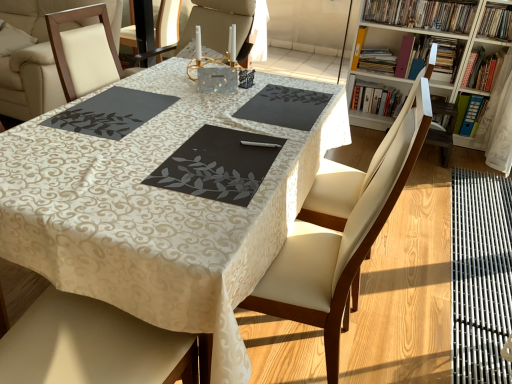
Identify the location of free region on the left part of black matte place mat at center, which appears as the second place mat when viewed from the right. The width and height of the screenshot is (512, 384). (116, 152).